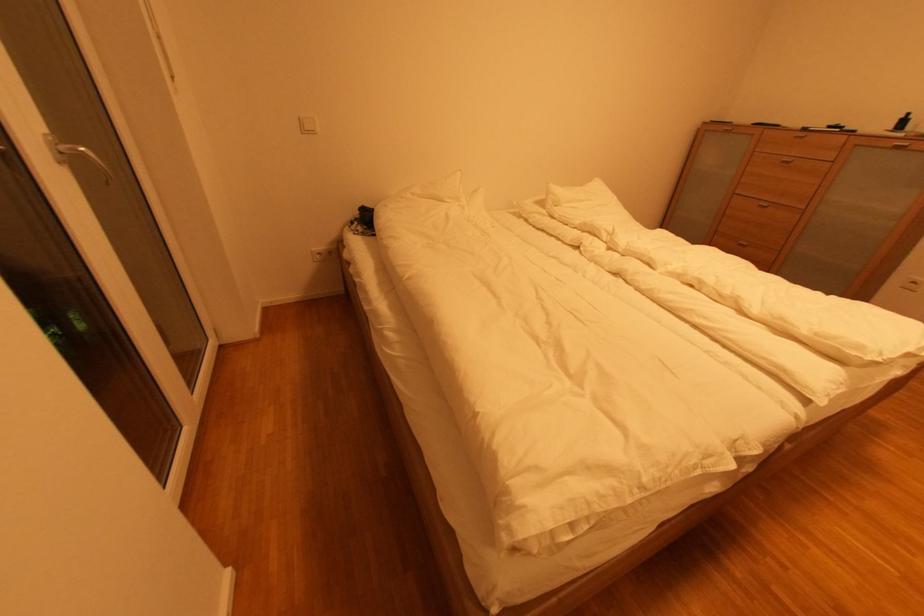
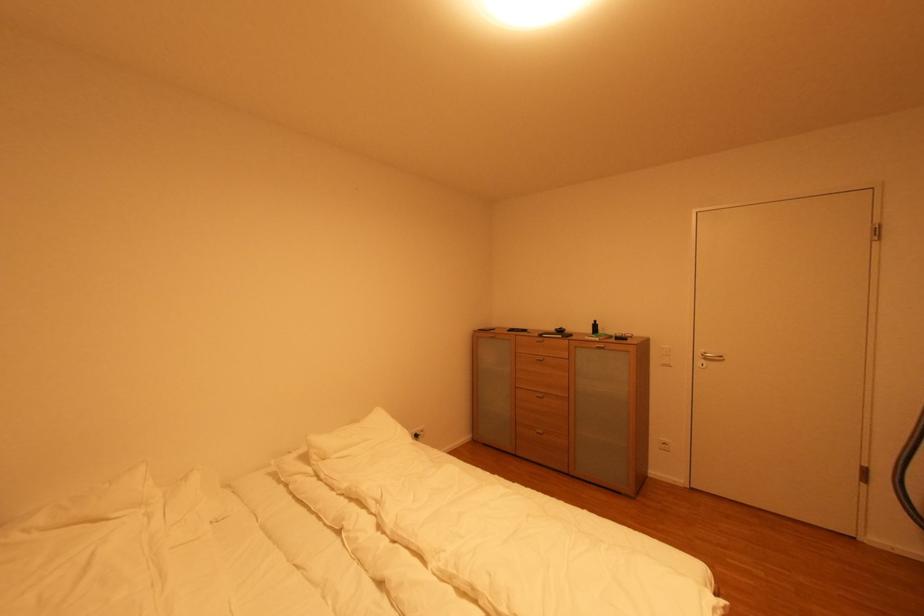
In the second image, find the point that corresponds to the point at 710,292 in the first image.

(485, 606)